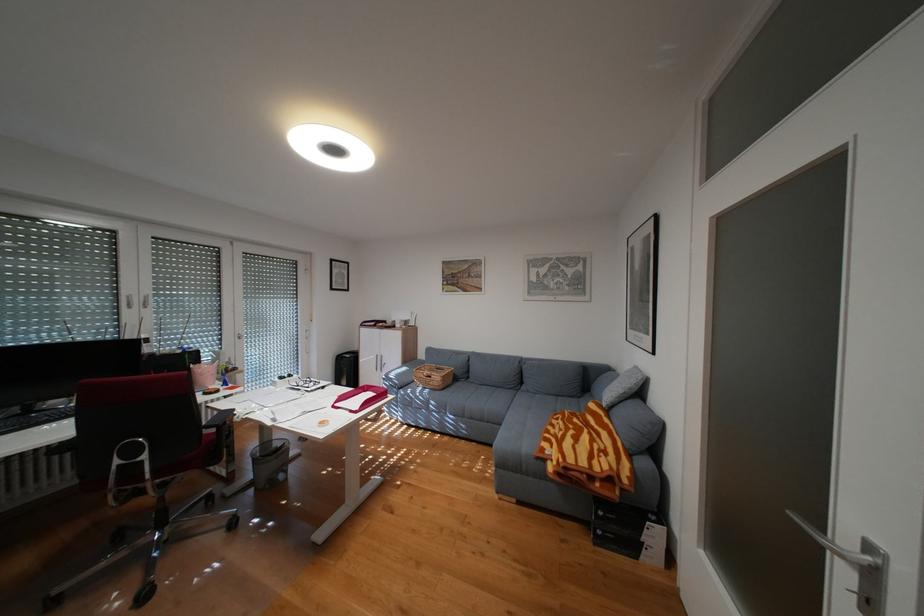
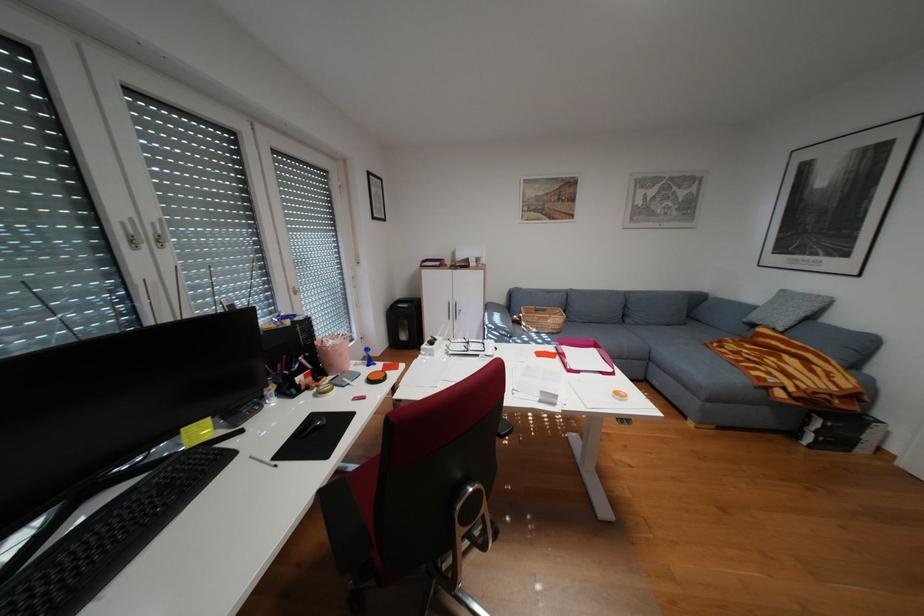
Where in the second image is the point corresponding to pixel 564 445 from the first image?

(782, 373)